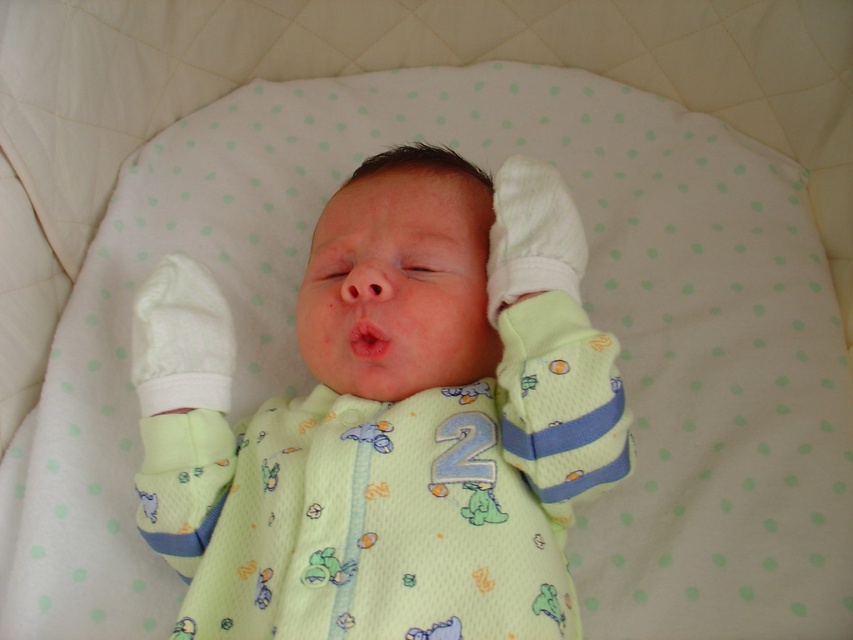
Question: Among these objects, which one is farthest from the camera?

Choices:
 (A) pink smooth flesh at center
 (B) light green jersey at center

Answer: (A)

Question: Which of the following is the closest to the observer?

Choices:
 (A) light green jersey at center
 (B) pink smooth flesh at center

Answer: (A)

Question: Is light green jersey at center further to camera compared to pink smooth flesh at center?

Choices:
 (A) no
 (B) yes

Answer: (A)

Question: Which point is closer to the camera?

Choices:
 (A) (416, 636)
 (B) (366, 339)

Answer: (A)

Question: Is light green jersey at center above pink smooth flesh at center?

Choices:
 (A) yes
 (B) no

Answer: (B)

Question: Is light green jersey at center positioned at the back of pink smooth flesh at center?

Choices:
 (A) no
 (B) yes

Answer: (A)